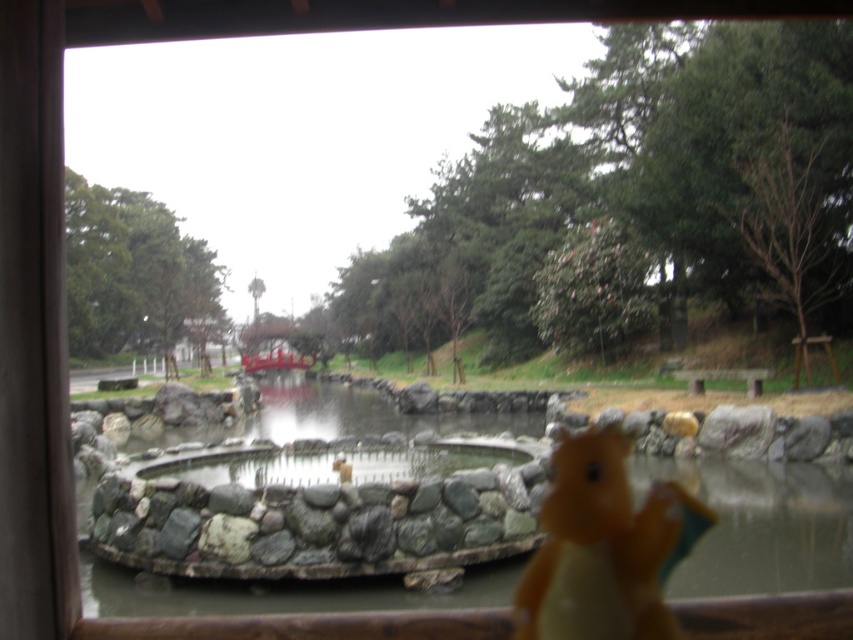
You are standing in a room looking through the window described in the scene. You see the smooth stone pond at center and the yellow rubber duck at lower right. Which object is closer to you, the observer?

The yellow rubber duck at lower right is behind the smooth stone pond at center, so the smooth stone pond at center is closer to you.

You are standing at the window looking at the smooth stone pond at center and the yellow rubber duck at lower right. If you want to place a 10 feet long wooden bench between them, will there be enough space?

The smooth stone pond at center and yellow rubber duck at lower right are 15.04 feet apart, so placing a 10 feet long wooden bench between them would be possible as the distance between them is sufficient.

You are standing in front of the window shown in the scene. You see the smooth stone pond at center and the yellow rubber duck at lower right. Which object is wider?

The smooth stone pond at center is wider than the yellow rubber duck at lower right.